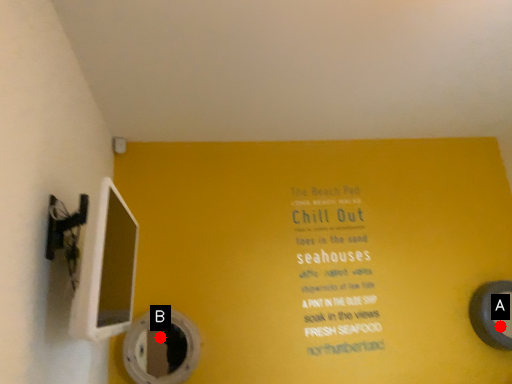
Question: Two points are circled on the image, labeled by A and B beside each circle. Among these points, which one is farthest from the camera?

Choices:
 (A) A is further
 (B) B is further

Answer: (A)